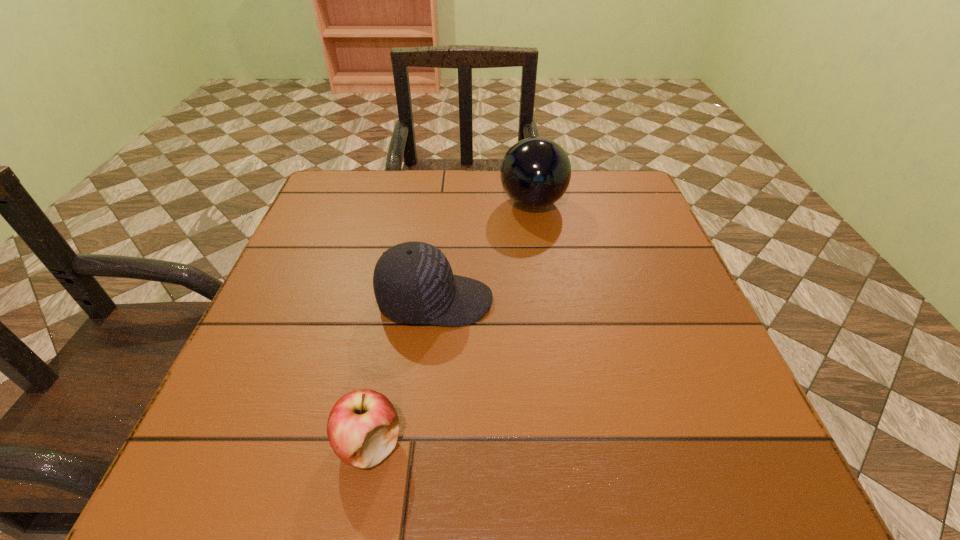
Locate an element on the screen. The image size is (960, 540). vacant area that lies between the second nearest object and the bowling ball is located at coordinates (484, 252).

This screenshot has height=540, width=960. Identify the location of vacant area that lies between the baseball cap and the tallest object. (484, 252).

What are the coordinates of `unoccupied position between the second tallest object and the nearest object` in the screenshot? It's located at (402, 373).

The image size is (960, 540). I want to click on free spot between the apple and the baseball cap, so click(402, 373).

Identify which object is the closest to the second shortest object. Please provide its 2D coordinates. Your answer should be formatted as a tuple, i.e. [(x, y)], where the tuple contains the x and y coordinates of a point satisfying the conditions above.

[(363, 426)]

Select which object is the second closest to the shortest object. Please provide its 2D coordinates. Your answer should be formatted as a tuple, i.e. [(x, y)], where the tuple contains the x and y coordinates of a point satisfying the conditions above.

[(535, 173)]

Where is `blank space that satisfies the following two spatial constraints: 1. on the side of the farthest object with the finger holes; 2. on the front side of the shortest object`? The width and height of the screenshot is (960, 540). blank space that satisfies the following two spatial constraints: 1. on the side of the farthest object with the finger holes; 2. on the front side of the shortest object is located at coordinates (570, 444).